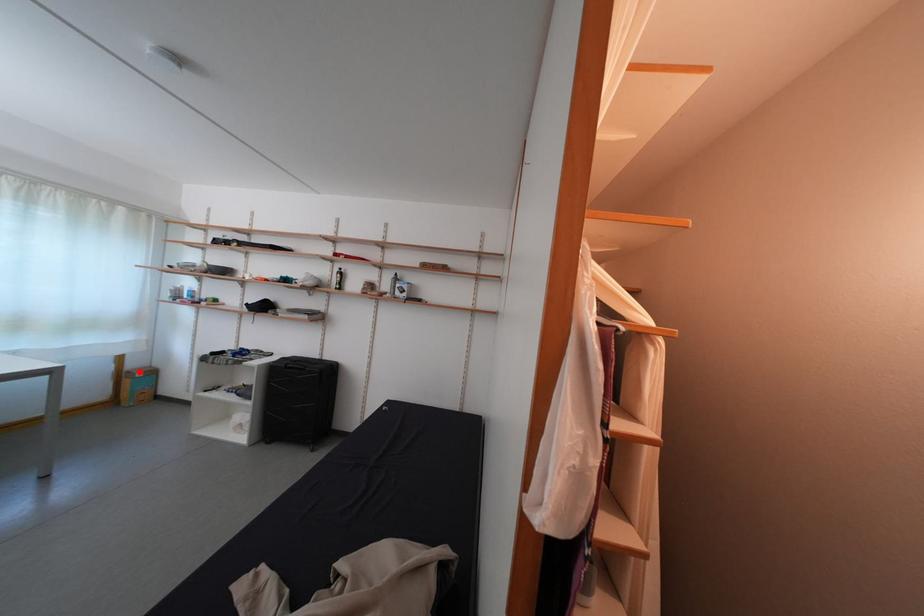
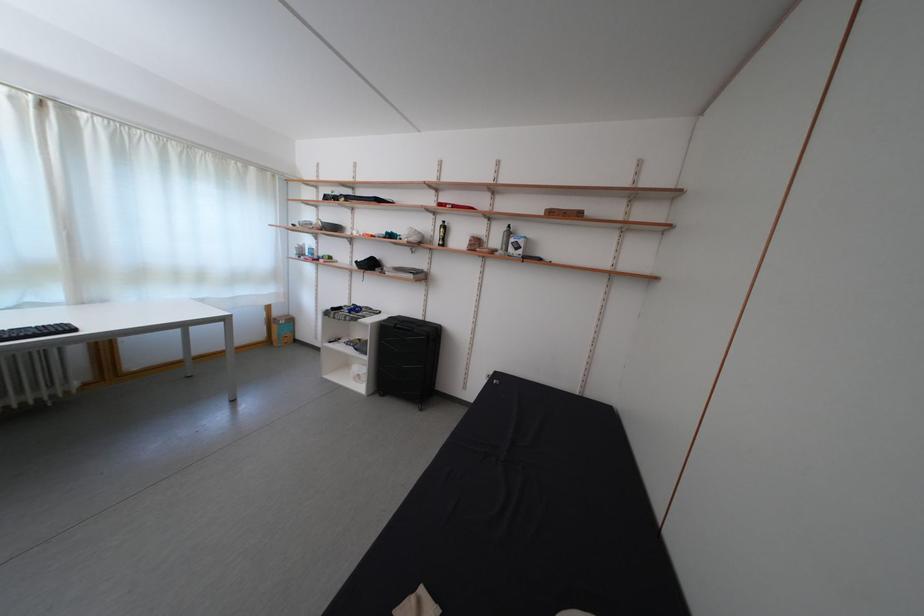
In the second image, find the point that corresponds to the highlighted location in the first image.

(285, 320)